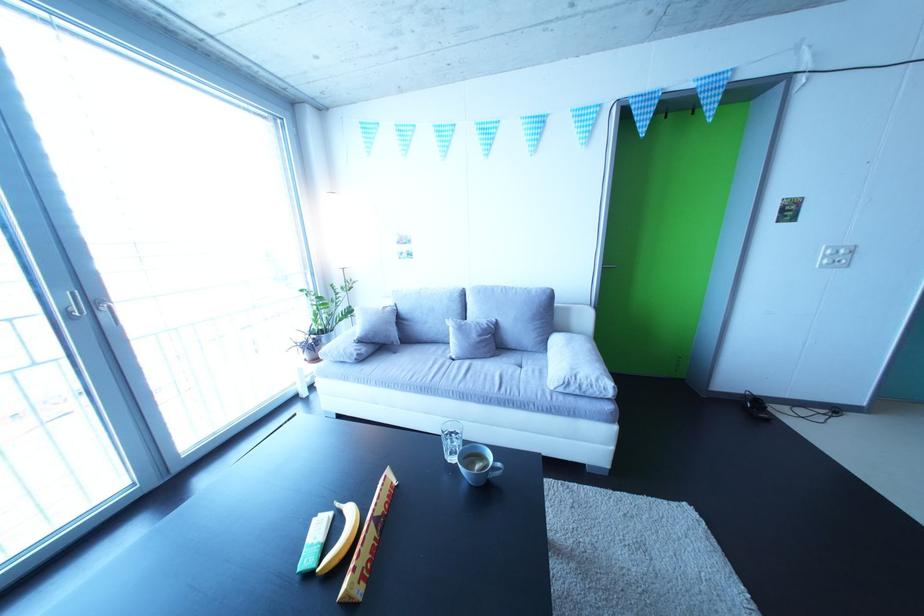
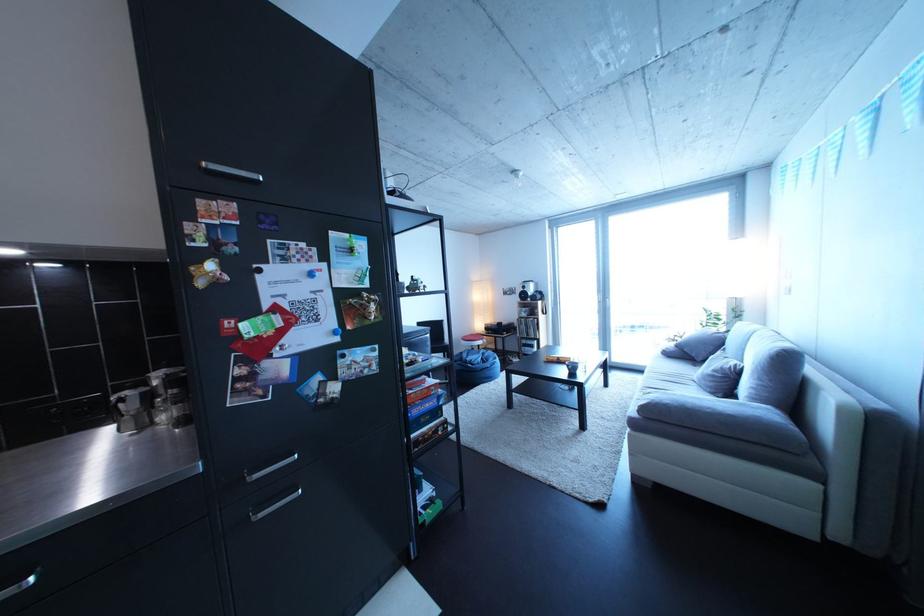
In the second image, find the point that corresponds to the point at 374,365 in the first image.

(682, 361)